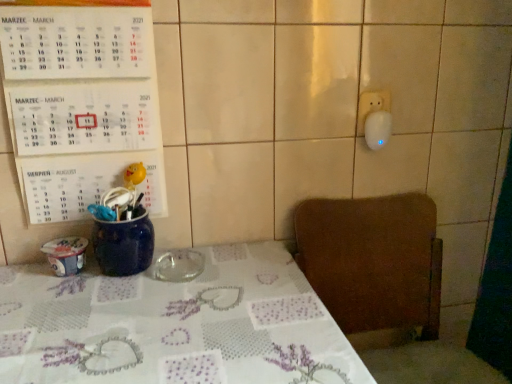
Question: In terms of height, does transparent glass ashtray at center look taller or shorter compared to white paper calendar at upper left?

Choices:
 (A) short
 (B) tall

Answer: (A)

Question: Is point (199, 273) closer or farther from the camera than point (35, 99)?

Choices:
 (A) farther
 (B) closer

Answer: (A)

Question: Which of these objects is positioned closest to the white paper calendar at upper left?

Choices:
 (A) transparent glass ashtray at center
 (B) brown wooden chair at lower right

Answer: (A)

Question: Which object is the closest to the brown wooden chair at lower right?

Choices:
 (A) transparent glass ashtray at center
 (B) white paper calendar at upper left

Answer: (A)